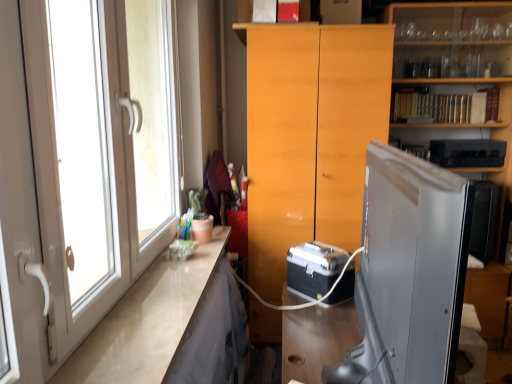
The image size is (512, 384). I want to click on free space above metallic silver briefcase at center, which is counted as the 1th appliance, starting from the left (from a real-world perspective), so click(x=320, y=249).